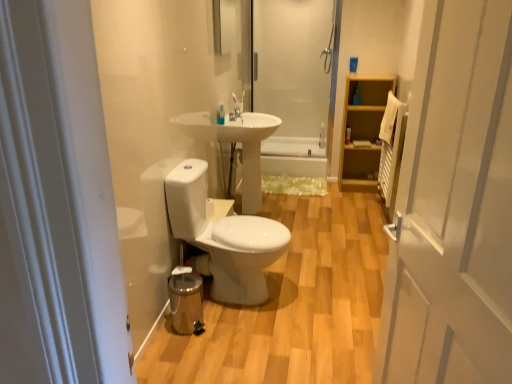
Identify the location of free space in front of white glossy toilet at center. (244, 341).